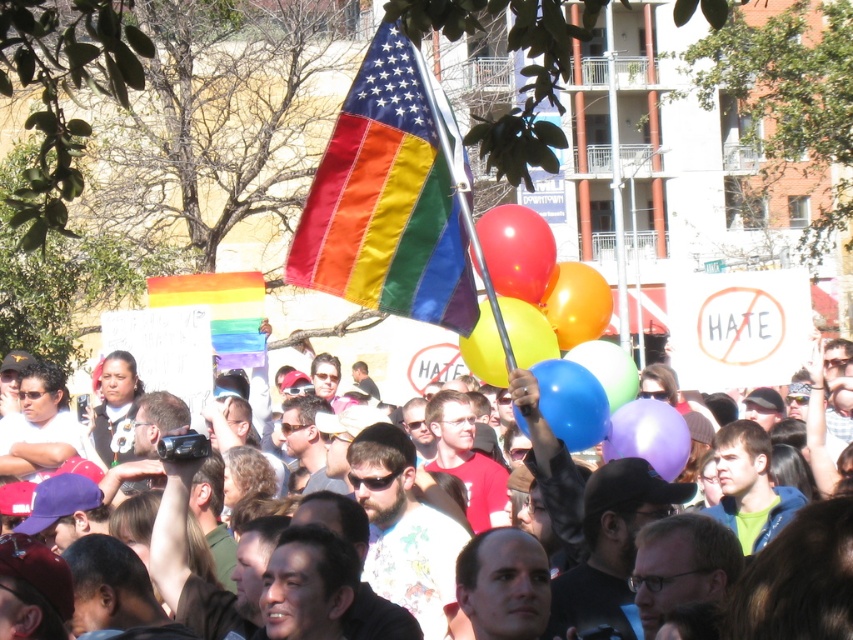
You are at the protest and want to grab a balloon. There are two balloons at the center. The shiny red balloon at center and the rubber balloon at center. Which one is closer to you?

The shiny red balloon at center is 8.24 feet away from the rubber balloon at center. Since you are at the center, both balloons are equally distant from you.